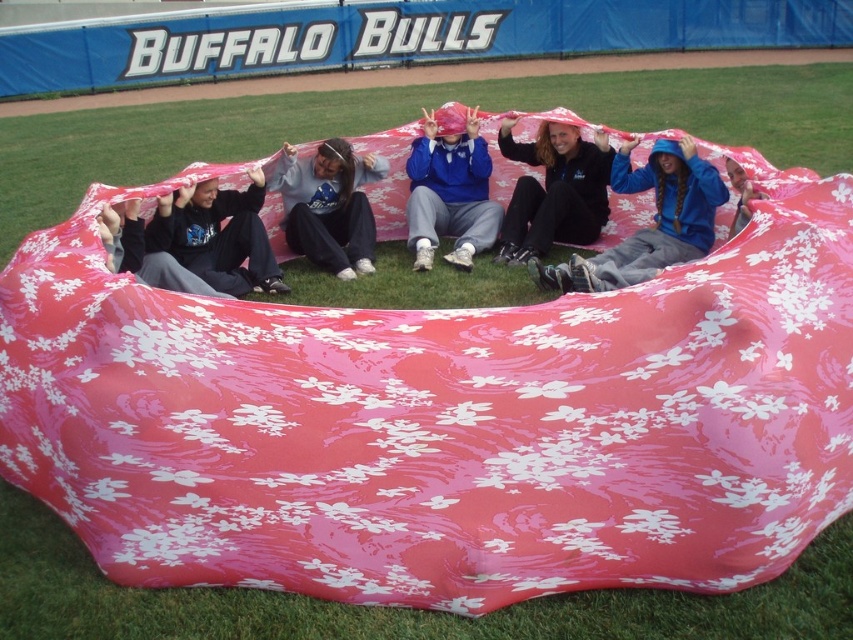
Question: Considering the relative positions of matte blue hoodie at center and matte blue jacket at center in the image provided, where is matte blue hoodie at center located with respect to matte blue jacket at center?

Choices:
 (A) left
 (B) right

Answer: (B)

Question: Which point is closer to the camera?

Choices:
 (A) matte gray sweatshirt at center
 (B) matte black hoodie at left

Answer: (B)

Question: Is matte blue hoodie at center smaller than matte black hoodie at center?

Choices:
 (A) no
 (B) yes

Answer: (A)

Question: Among these objects, which one is nearest to the camera?

Choices:
 (A) matte blue jacket at center
 (B) matte gray sweatshirt at center
 (C) matte black hoodie at center

Answer: (B)

Question: Can you confirm if matte blue hoodie at center is thinner than matte black hoodie at left?

Choices:
 (A) no
 (B) yes

Answer: (A)

Question: Which point is farther to the camera?

Choices:
 (A) (282, 166)
 (B) (479, 180)
 (C) (662, 218)

Answer: (B)